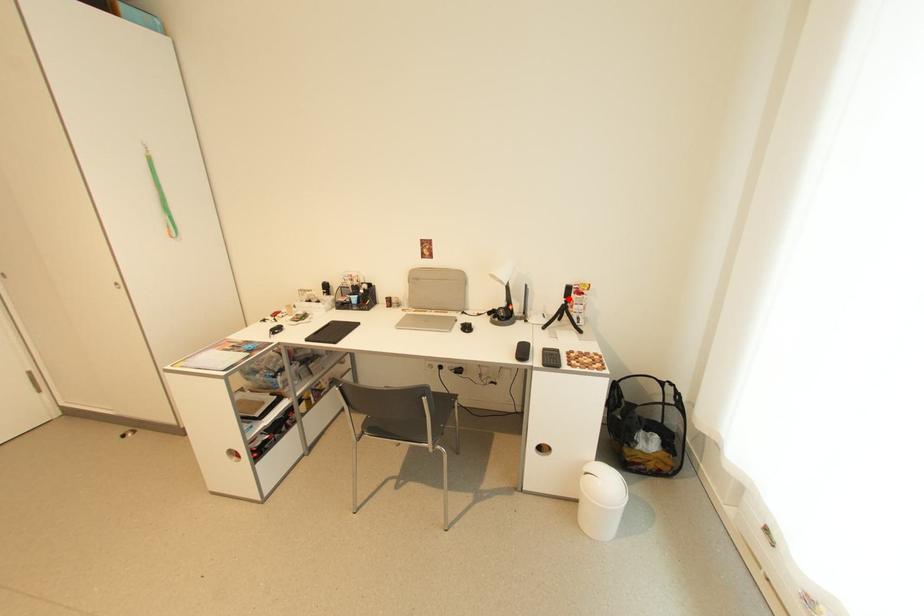
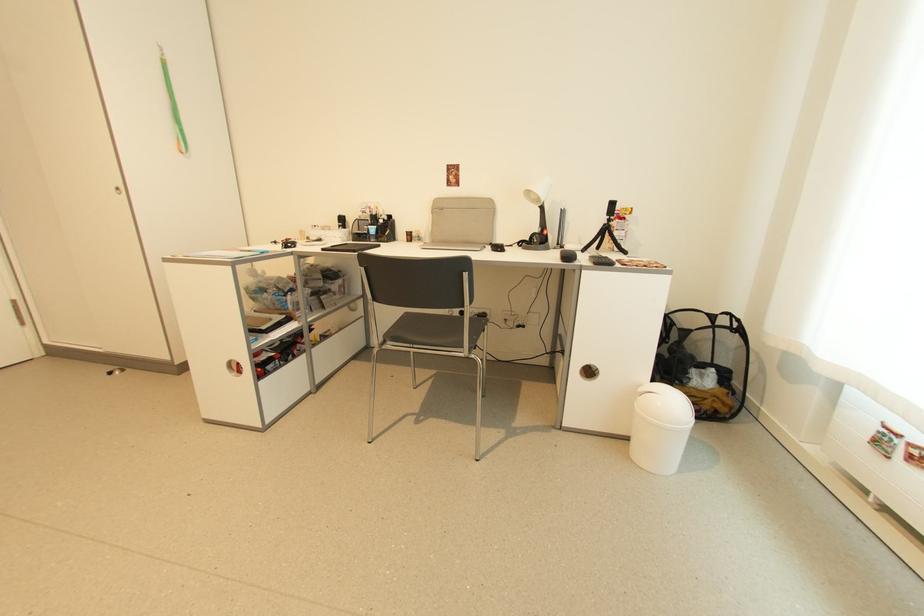
Question: I am providing you with two images of the same scene from different viewpoints. Given a red point in image1, look at the same physical point in image2. Is it:

Choices:
 (A) Closer to the viewpoint
 (B) Farther from the viewpoint

Answer: (B)